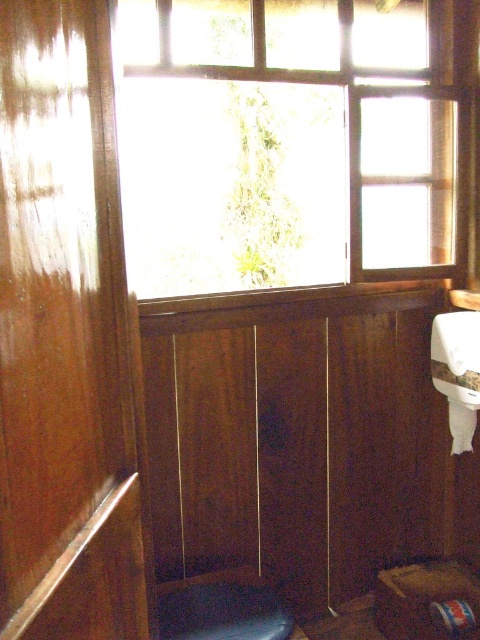
You are standing in the room shown in the image. Where is the transparent glass window at upper center located in terms of coordinates?

The transparent glass window at upper center is located at point coordinates of (307, 122).

You are an interior designer assessing the space. You need to place a new decorative item that is 1 meter wide between the transparent glass window at upper center and the dark blue fabric stool at lower center. Given their widths, will the space between them accommodate the item?

The transparent glass window at upper center is wider than the dark blue fabric stool at lower center. However, the question of whether the space between them can accommodate a 1 meter wide item requires knowing the actual distance between them, not just their widths. Since the provided information only compares their widths and not the space between them, it is impossible to determine if the 1 meter wide item will fit without additional measurements.